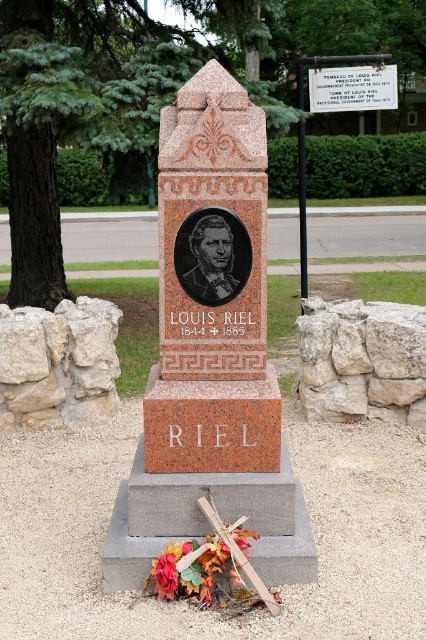
You are a park maintenance worker who needs to clean both the leaves and twigs at lower center and the white marble plaque at upper center. Which object requires a wider cleaning tool? Explain your reasoning based on their sizes.

The white marble plaque at upper center requires a wider cleaning tool because it has a greater width than the leaves and twigs at lower center.

You are standing in front of the monument and want to place a wreath at the base. The wreath needs to be placed to the left of the white marble plaque at upper center. Can you place it on the red granite monument at center?

The red granite monument at center is to the left of the white marble plaque at upper center. Therefore, placing the wreath at the base of the red granite monument at center would position it to the left of the white marble plaque at upper center.

You are an artist sketching the monument and notice two elements in the scene. One is leaves and twigs at lower center and the other is white marble plaque at upper center. Which of these two elements is smaller in size?

The leaves and twigs at lower center is smaller than the white marble plaque at upper center.